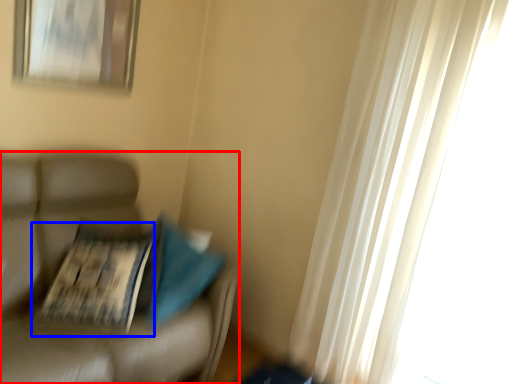
Question: Which object appears farthest to the camera in this image, furniture (highlighted by a red box) or magazine (highlighted by a blue box)?

Choices:
 (A) furniture
 (B) magazine

Answer: (B)